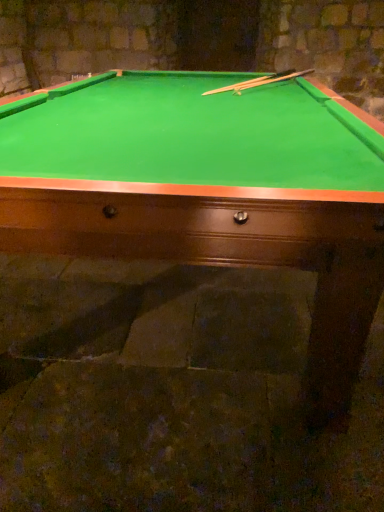
What do you see at coordinates (259, 81) in the screenshot? The width and height of the screenshot is (384, 512). I see `smooth wood cue at upper center` at bounding box center [259, 81].

This screenshot has width=384, height=512. I want to click on smooth wood cue at upper center, so click(259, 81).

What do you see at coordinates (209, 191) in the screenshot? I see `green felt billiard table at center` at bounding box center [209, 191].

You are a GUI agent. You are given a task and a screenshot of the screen. Output one action in this format:
    pyautogui.click(x=<x>, y=<y>)
    Task: Click on the green felt billiard table at center
    This screenshot has height=512, width=384.
    Given the screenshot: What is the action you would take?
    pyautogui.click(x=209, y=191)

I want to click on smooth wood cue at upper center, so click(x=259, y=81).

Considering the relative positions of smooth wood cue at upper center and green felt billiard table at center in the image provided, is smooth wood cue at upper center to the left of green felt billiard table at center from the viewer's perspective?

No.

Is smooth wood cue at upper center positioned in front of green felt billiard table at center?

No, the depth of smooth wood cue at upper center is greater than that of green felt billiard table at center.

Is point (268, 79) positioned after point (358, 286)?

Yes, it is behind point (358, 286).

From the image's perspective, is smooth wood cue at upper center located above or below green felt billiard table at center?

Clearly, from the image's perspective, smooth wood cue at upper center is above green felt billiard table at center.

From a real-world perspective, is smooth wood cue at upper center physically located above or below green felt billiard table at center?

Clearly, from a real-world perspective, smooth wood cue at upper center is above green felt billiard table at center.

Which of these two, smooth wood cue at upper center or green felt billiard table at center, is thinner?

Thinner between the two is smooth wood cue at upper center.

Can you confirm if smooth wood cue at upper center is taller than green felt billiard table at center?

In fact, smooth wood cue at upper center may be shorter than green felt billiard table at center.

From the picture: Does smooth wood cue at upper center have a smaller size compared to green felt billiard table at center?

Yes.

Would you say smooth wood cue at upper center is inside or outside green felt billiard table at center?

The correct answer is: inside.

Is smooth wood cue at upper center placed right next to green felt billiard table at center?

smooth wood cue at upper center and green felt billiard table at center are not in contact.

Is smooth wood cue at upper center turned away from green felt billiard table at center?

Yes, smooth wood cue at upper center is positioned with its back facing green felt billiard table at center.

How different are the orientations of smooth wood cue at upper center and green felt billiard table at center in degrees?

The facing directions of smooth wood cue at upper center and green felt billiard table at center are 62.5 degrees apart.

Locate an element on the screen. Image resolution: width=384 pixels, height=512 pixels. billiard table below the smooth wood cue at upper center (from a real-world perspective) is located at coordinates (209, 191).

Between green felt billiard table at center and smooth wood cue at upper center, which one appears on the right side from the viewer's perspective?

smooth wood cue at upper center.

Does green felt billiard table at center lie behind smooth wood cue at upper center?

No.

Which point is more distant from viewer, (100, 88) or (244, 88)?

The point (244, 88) is farther.

From the image's perspective, is green felt billiard table at center positioned above or below smooth wood cue at upper center?

Based on their image positions, green felt billiard table at center is located beneath smooth wood cue at upper center.

From a real-world perspective, relative to smooth wood cue at upper center, is green felt billiard table at center vertically above or below?

green felt billiard table at center is below smooth wood cue at upper center.

Between green felt billiard table at center and smooth wood cue at upper center, which one has larger width?

green felt billiard table at center is wider.

Considering the sizes of objects green felt billiard table at center and smooth wood cue at upper center in the image provided, who is taller, green felt billiard table at center or smooth wood cue at upper center?

With more height is green felt billiard table at center.

Who is smaller, green felt billiard table at center or smooth wood cue at upper center?

smooth wood cue at upper center is smaller.

Could smooth wood cue at upper center be considered to be inside green felt billiard table at center?

Answer: Yes, smooth wood cue at upper center is a part of green felt billiard table at center.

Does green felt billiard table at center touch smooth wood cue at upper center?

There is a gap between green felt billiard table at center and smooth wood cue at upper center.

Could you tell me if green felt billiard table at center is turned towards smooth wood cue at upper center?

No, green felt billiard table at center is not turned towards smooth wood cue at upper center.

How far apart are green felt billiard table at center and smooth wood cue at upper center?

They are 1.07 meters apart.

This screenshot has width=384, height=512. Find the location of `cue behind the green felt billiard table at center`. cue behind the green felt billiard table at center is located at coordinates (259, 81).

I want to click on billiard table below the smooth wood cue at upper center (from the image's perspective), so [x=209, y=191].

Locate an element on the screen. cue above the green felt billiard table at center (from a real-world perspective) is located at coordinates (259, 81).